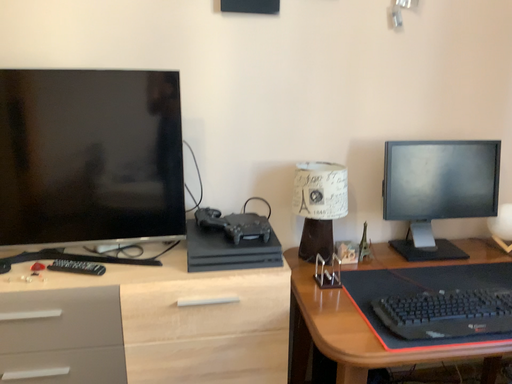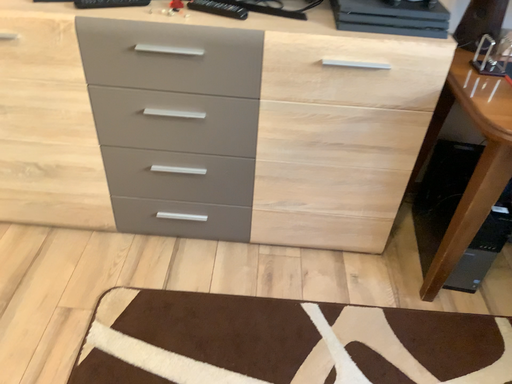
Question: Which way did the camera rotate in the video?

Choices:
 (A) rotated left
 (B) rotated right

Answer: (A)